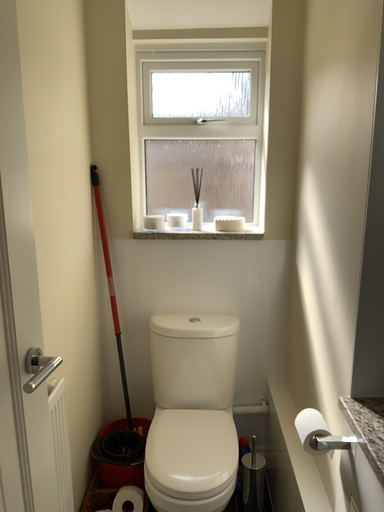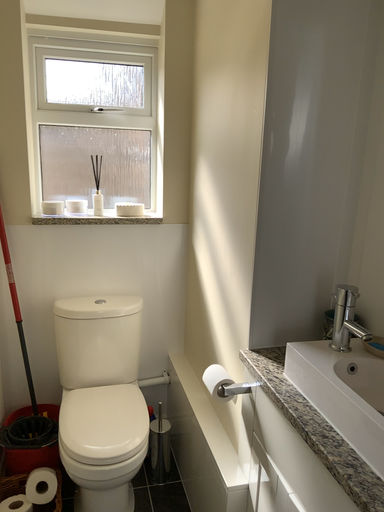
Question: Which way did the camera rotate in the video?

Choices:
 (A) rotated left
 (B) rotated right

Answer: (B)